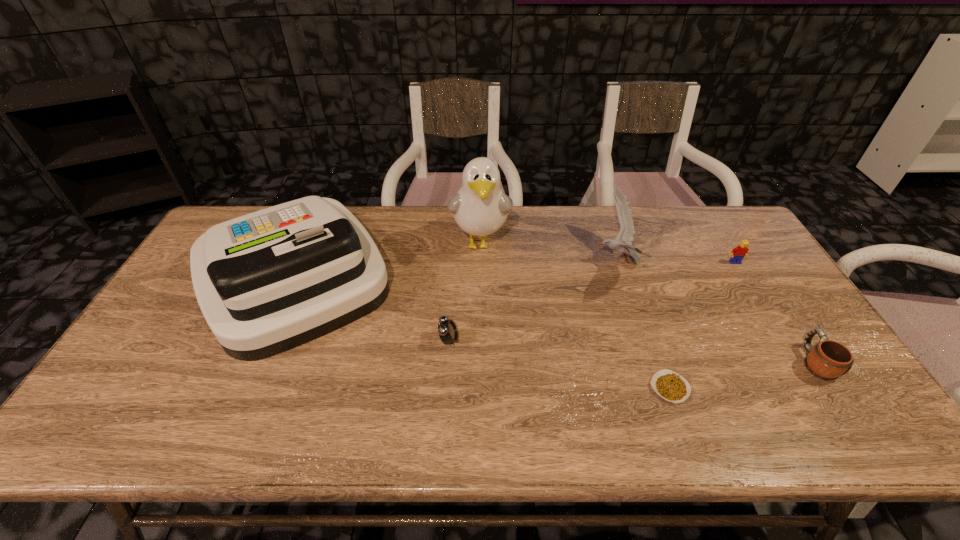
Where is `the tallest object`? This screenshot has height=540, width=960. the tallest object is located at coordinates (480, 207).

Identify the location of the taller gull. The width and height of the screenshot is (960, 540). (480, 207).

Find the location of `the leftmost object`. the leftmost object is located at coordinates (266, 282).

This screenshot has width=960, height=540. What are the coordinates of `the second tallest object` in the screenshot? It's located at (266, 282).

Image resolution: width=960 pixels, height=540 pixels. I want to click on the shorter gull, so click(x=626, y=233).

Find the location of `the right gull`. the right gull is located at coordinates (626, 233).

Identify the location of Lego. The image size is (960, 540). (738, 253).

Identify the location of alarm clock. (447, 330).

Image resolution: width=960 pixels, height=540 pixels. In order to click on mug in this screenshot , I will do `click(829, 360)`.

You are a GUI agent. You are given a task and a screenshot of the screen. Output one action in this format:
    pyautogui.click(x=<x>, y=<y>)
    Task: Click on the legume
    This screenshot has width=960, height=540.
    Given the screenshot: What is the action you would take?
    pyautogui.click(x=669, y=385)